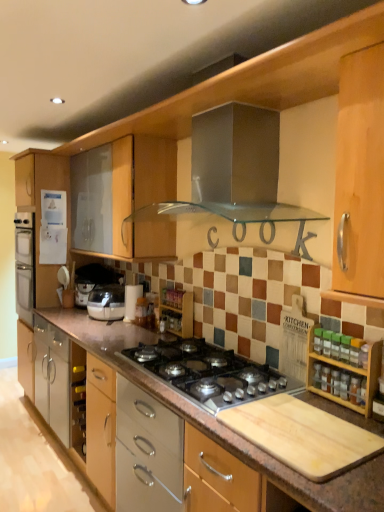
Question: Is matte white blender at center further to camera compared to wooden spice rack at right, marked as the first cabinetry in a right-to-left arrangement?

Choices:
 (A) no
 (B) yes

Answer: (B)

Question: Is matte white blender at center oriented away from wooden spice rack at right, marked as the 1th cabinetry in a front-to-back arrangement?

Choices:
 (A) yes
 (B) no

Answer: (B)

Question: From a real-world perspective, is matte white blender at center under wooden spice rack at right, which is counted as the 2th cabinetry, starting from the back?

Choices:
 (A) yes
 (B) no

Answer: (A)

Question: From a real-world perspective, is matte white blender at center located higher than wooden spice rack at right, marked as the 1th cabinetry in a front-to-back arrangement?

Choices:
 (A) no
 (B) yes

Answer: (A)

Question: Considering the relative sizes of matte white blender at center and wooden spice rack at right, the 1th cabinetry when ordered from top to bottom, in the image provided, is matte white blender at center shorter than wooden spice rack at right, the 1th cabinetry when ordered from top to bottom,?

Choices:
 (A) no
 (B) yes

Answer: (B)

Question: Considering the relative positions of matte white blender at center and wooden spice rack at right, marked as the 1th cabinetry in a front-to-back arrangement, in the image provided, is matte white blender at center to the left of wooden spice rack at right, marked as the 1th cabinetry in a front-to-back arrangement, from the viewer's perspective?

Choices:
 (A) no
 (B) yes

Answer: (B)

Question: Does wooden spice rack at center appear on the right side of wooden spice rack at right, which is counted as the 2th cabinetry, starting from the back?

Choices:
 (A) yes
 (B) no

Answer: (B)

Question: From the image's perspective, is wooden spice rack at center below wooden spice rack at right, positioned as the 2th cabinetry in bottom-to-top order?

Choices:
 (A) yes
 (B) no

Answer: (B)

Question: Is wooden spice rack at center bigger than wooden spice rack at right, the 1th cabinetry when ordered from top to bottom?

Choices:
 (A) yes
 (B) no

Answer: (A)

Question: Would you consider wooden spice rack at center to be distant from wooden spice rack at right, marked as the 1th cabinetry in a front-to-back arrangement?

Choices:
 (A) yes
 (B) no

Answer: (A)

Question: Considering the relative sizes of wooden spice rack at center and wooden spice rack at right, positioned as the 2th cabinetry in bottom-to-top order, in the image provided, is wooden spice rack at center wider than wooden spice rack at right, positioned as the 2th cabinetry in bottom-to-top order,?

Choices:
 (A) no
 (B) yes

Answer: (B)

Question: Considering the relative sizes of wooden spice rack at center and wooden spice rack at right, which is counted as the 2th cabinetry, starting from the back, in the image provided, is wooden spice rack at center taller than wooden spice rack at right, which is counted as the 2th cabinetry, starting from the back,?

Choices:
 (A) no
 (B) yes

Answer: (A)

Question: Does wooden spice rack at center have a greater width compared to white paper towel holder at center, the first appliance when ordered from right to left?

Choices:
 (A) yes
 (B) no

Answer: (B)